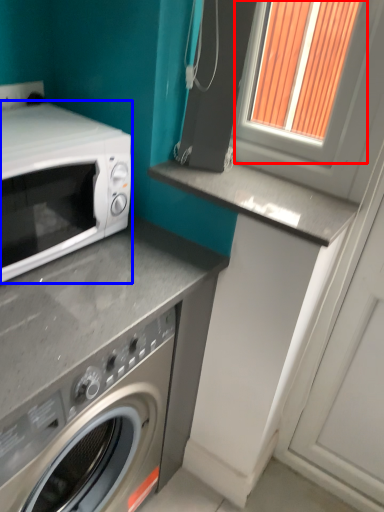
Question: Among these objects, which one is nearest to the camera, window frame (highlighted by a red box) or microwave oven (highlighted by a blue box)?

Choices:
 (A) window frame
 (B) microwave oven

Answer: (B)